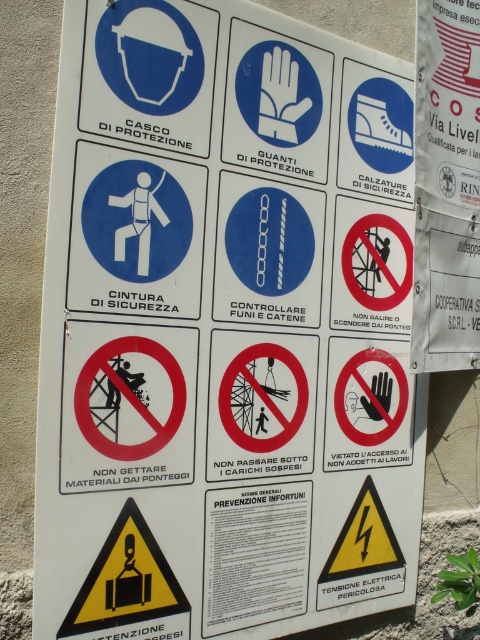
In the scene shown: Which of these two, blue plastic helmet at upper left or blue glossy chain at center, stands shorter?

blue plastic helmet at upper left

Can you confirm if blue plastic helmet at upper left is taller than blue glossy chain at center?

In fact, blue plastic helmet at upper left may be shorter than blue glossy chain at center.

This screenshot has height=640, width=480. What do you see at coordinates (149, 74) in the screenshot? I see `blue plastic helmet at upper left` at bounding box center [149, 74].

Identify the location of blue plastic helmet at upper left. The width and height of the screenshot is (480, 640). (149, 74).

Does blue matte safety harness at center lie in front of blue plastic helmet at upper left?

No, it is behind blue plastic helmet at upper left.

Is blue matte safety harness at center taller than blue plastic helmet at upper left?

Indeed, blue matte safety harness at center has a greater height compared to blue plastic helmet at upper left.

Between point (132, 212) and point (192, 65), which one is positioned in front?

Positioned in front is point (132, 212).

This screenshot has height=640, width=480. I want to click on blue matte safety harness at center, so click(135, 234).

Can you confirm if red circle sign at center is wider than blue plastic helmet at upper left?

No.

Can you confirm if red circle sign at center is positioned to the left of blue plastic helmet at upper left?

Yes, red circle sign at center is to the left of blue plastic helmet at upper left.

Does point (99, 413) come in front of point (151, 19)?

Yes, point (99, 413) is closer to viewer.

I want to click on red circle sign at center, so click(127, 404).